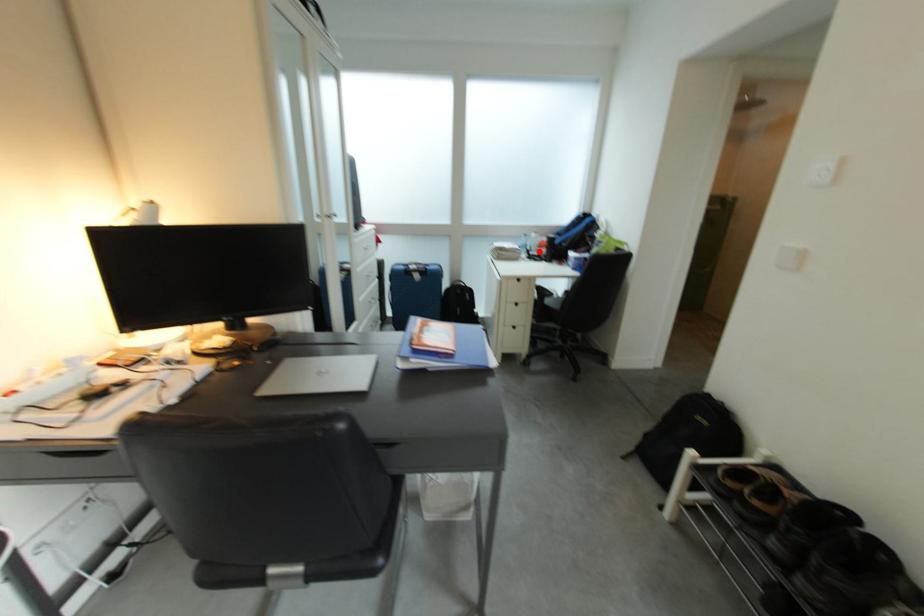
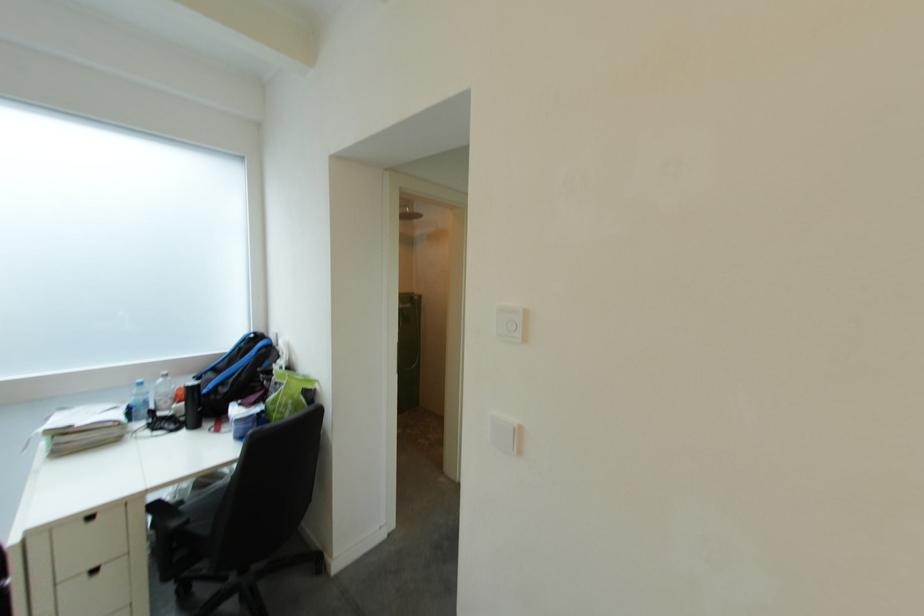
The point at the highlighted location is marked in the first image. Where is the corresponding point in the second image?

(163, 410)